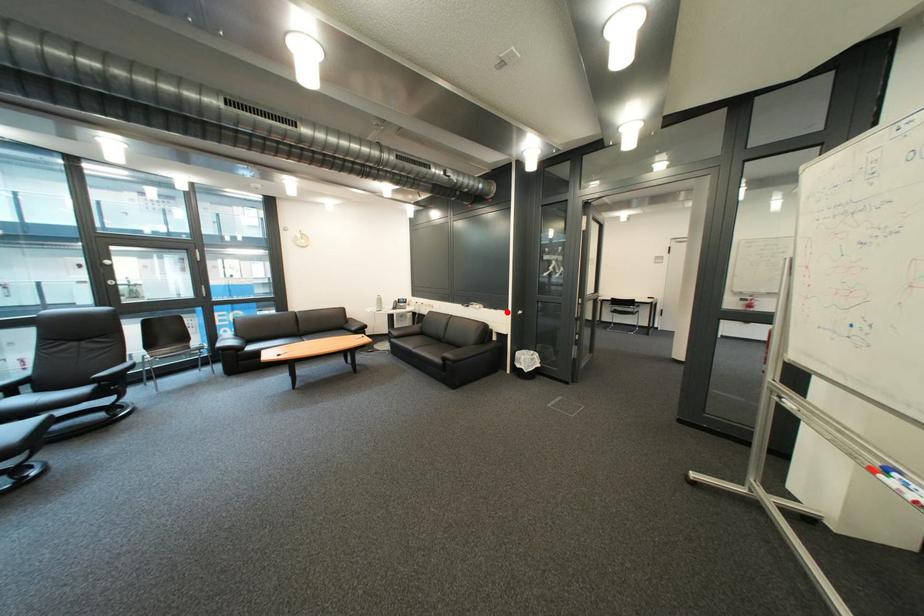
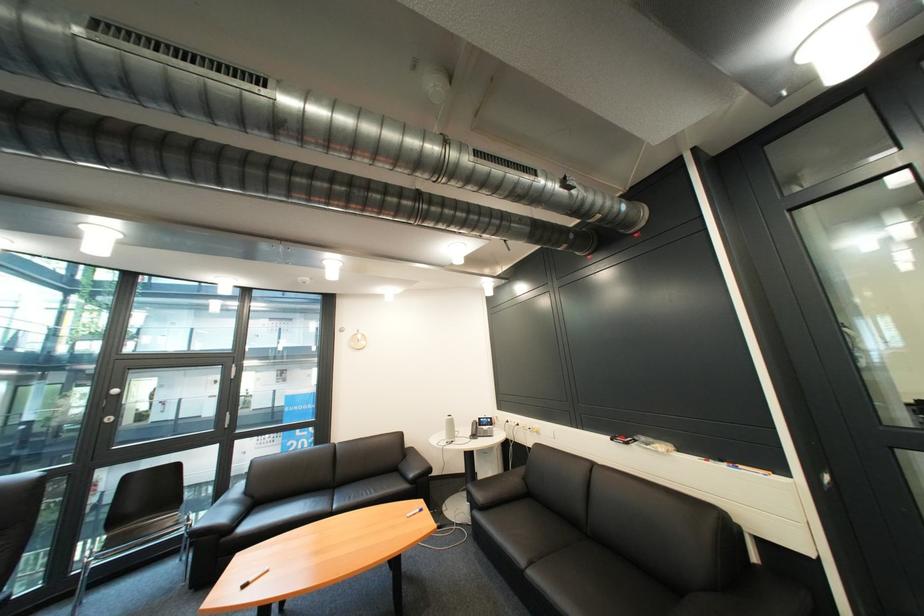
Where in the second image is the point corresponding to the highlighted location from the first image?

(736, 468)